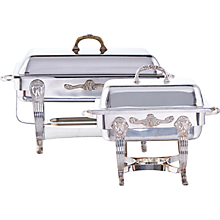
Locate an element on the screen. large silver chafing dish is located at coordinates (35, 59).